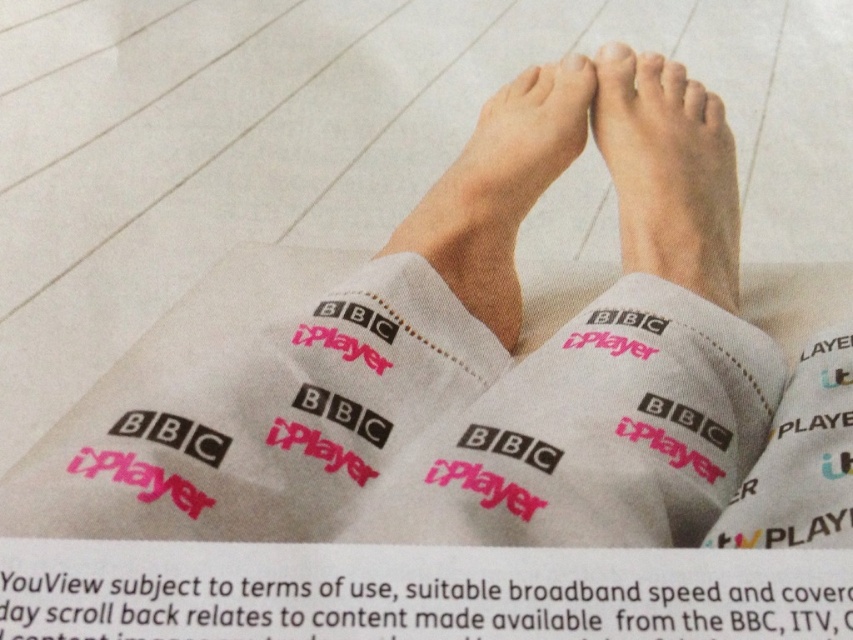
You are a photographer setting up a shoot focusing on the feet in the image. You need to ensure that the smooth skin foot at center and the matte skin toe at upper center are both clearly visible in the final shot. Based on their positions, which object should be lit more brightly to highlight its texture?

The matte skin toe at upper center should be lit more brightly because it is positioned above the smooth skin foot at center, and to ensure its texture stands out against the background.

You are designing a shoe that needs to accommodate both the smooth skin foot at center and the white matte toe at center. Which part requires a wider space in the shoe design?

The smooth skin foot at center requires a wider space in the shoe design because its width is larger than the white matte toe at center.

You are a photographer setting up a shoot focusing on the feet in the image. You need to ensure that both the skinny white leg at center and the pink matte toe at center are in focus. Given that your camera can only focus on one plane, which object should you prioritize focusing on to ensure at least one is sharp?

You should prioritize focusing on the skinny white leg at center because it is closer to the viewer than the pink matte toe at center. Since the camera can only focus on one plane, focusing on the closer object increases the chance that it will be sharp, while the farther object may still be somewhat in focus due to depth of field.